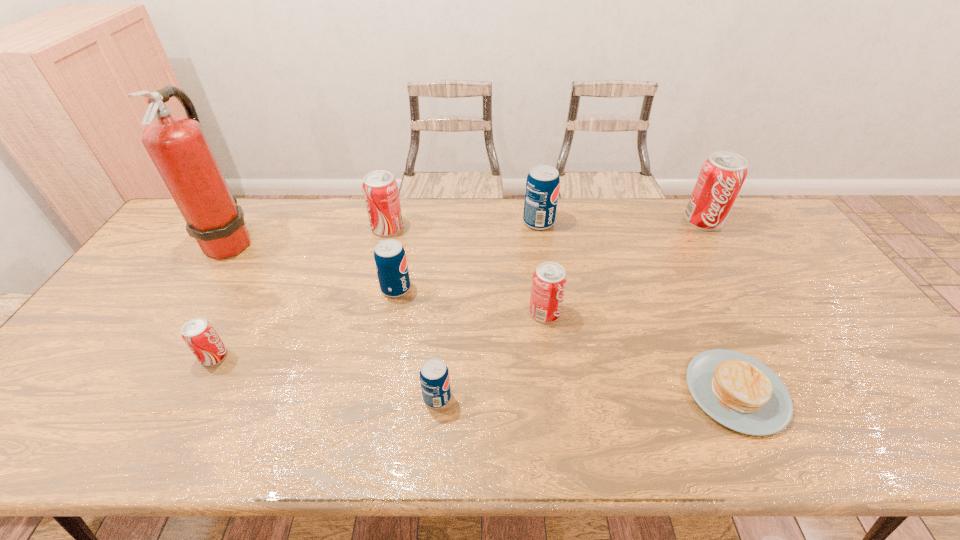
Identify the location of the third farthest red soda can. This screenshot has height=540, width=960. (549, 281).

Where is `the leftmost pop`? the leftmost pop is located at coordinates (199, 335).

Locate an element on the screen. The width and height of the screenshot is (960, 540). the second nearest pop is located at coordinates tap(199, 335).

Find the location of a particular element. The image size is (960, 540). the second blue pop from left to right is located at coordinates (434, 376).

Where is `the fourth pop from left to right`? The image size is (960, 540). the fourth pop from left to right is located at coordinates (434, 376).

Find the location of a particular element. the shortest object is located at coordinates (738, 391).

You are a GUI agent. You are given a task and a screenshot of the screen. Output one action in this format:
    pyautogui.click(x=<x>, y=<y>)
    Task: Click on the free point located 0.060m at the nozzle of the tallest object
    Image resolution: width=960 pixels, height=540 pixels.
    Given the screenshot: What is the action you would take?
    pyautogui.click(x=275, y=240)

Find the location of a particular element. The image size is (960, 540). vacant space situated on the left of the eighth shortest object is located at coordinates (588, 221).

You are a GUI agent. You are given a task and a screenshot of the screen. Output one action in this format:
    pyautogui.click(x=<x>, y=<y>)
    Task: Click on the vacant space located on the front of the second biggest red soda can
    This screenshot has height=540, width=960.
    Given the screenshot: What is the action you would take?
    pyautogui.click(x=373, y=283)

Identify the location of vacant space situated 0.300m on the left of the biggest blue pop. The image size is (960, 540). (436, 222).